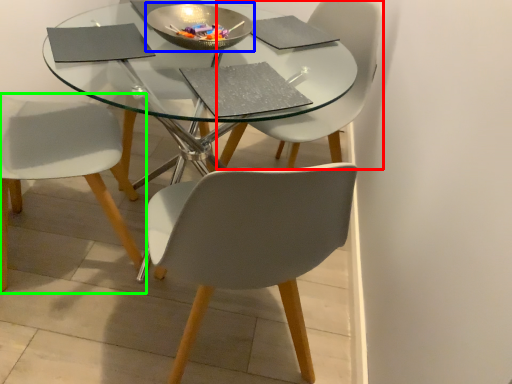
Question: Based on their relative distances, which object is farther from chair (highlighted by a red box)? Choose from bowl (highlighted by a blue box) and chair (highlighted by a green box).

Choices:
 (A) bowl
 (B) chair

Answer: (B)